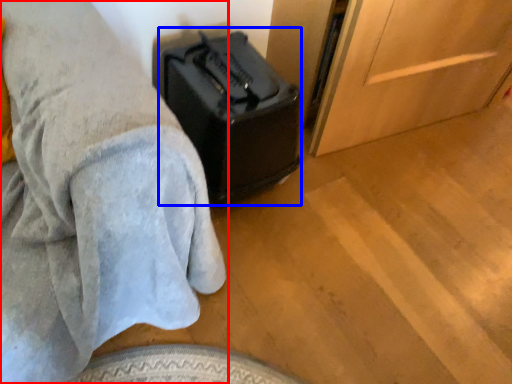
Question: Which object appears farthest to the camera in this image, furniture (highlighted by a red box) or luggage (highlighted by a blue box)?

Choices:
 (A) furniture
 (B) luggage

Answer: (B)